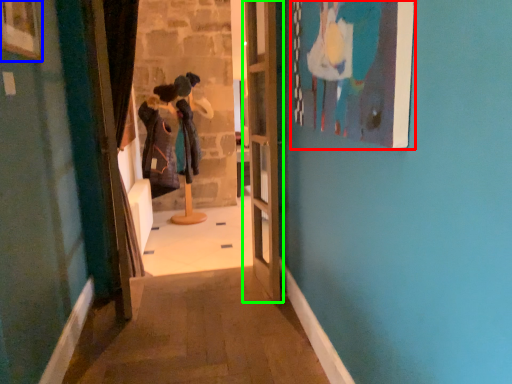
Question: Estimate the real-world distances between objects in this image. Which object is closer to picture frame (highlighted by a red box), picture frame (highlighted by a blue box) or door (highlighted by a green box)?

Choices:
 (A) picture frame
 (B) door

Answer: (B)